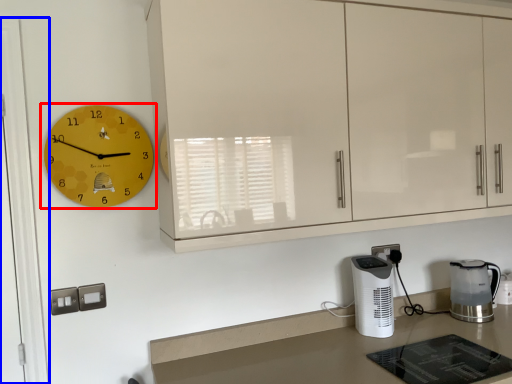
Question: Which object appears closest to the camera in this image, wall clock (highlighted by a red box) or glass door (highlighted by a blue box)?

Choices:
 (A) wall clock
 (B) glass door

Answer: (B)